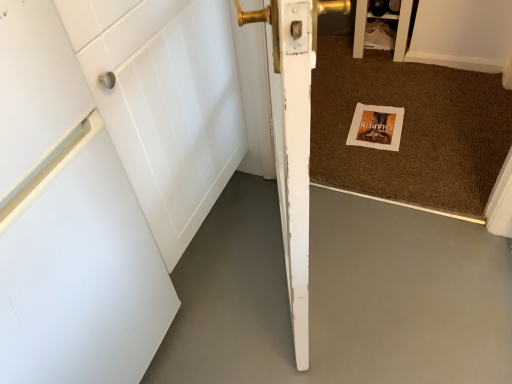
You are a GUI agent. You are given a task and a screenshot of the screen. Output one action in this format:
    pyautogui.click(x=<x>, y=<y>)
    Task: Click on the free space below white paper postcard at center (from a real-world perspective)
    
    Given the screenshot: What is the action you would take?
    pyautogui.click(x=377, y=125)